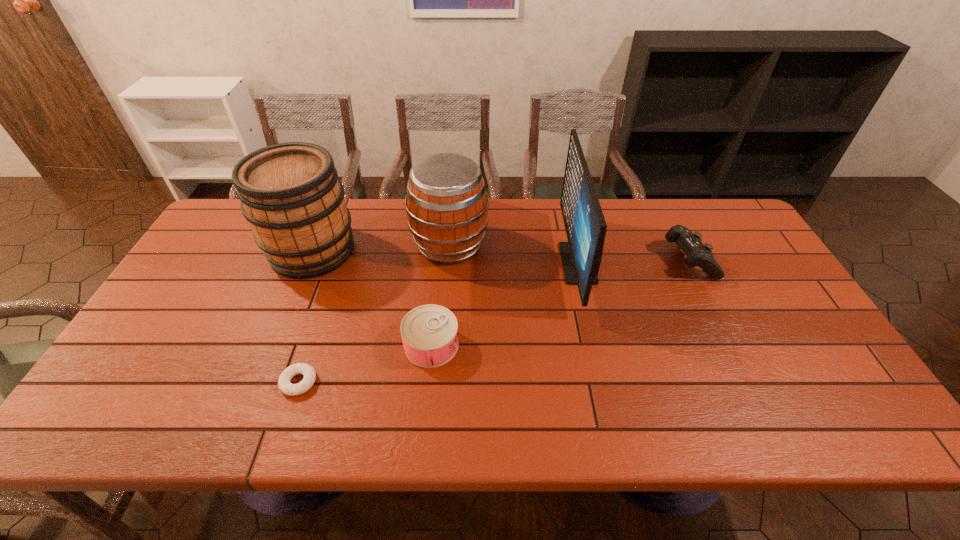
This screenshot has height=540, width=960. In order to click on vacant area that lies between the fifth object from left to right and the right cider in this screenshot , I will do `click(514, 254)`.

Identify the location of the fifth closest object relative to the left cider. (698, 254).

Where is `the fourth closest object relative to the doughnut`? The width and height of the screenshot is (960, 540). the fourth closest object relative to the doughnut is located at coordinates (585, 225).

Locate an element on the screen. This screenshot has width=960, height=540. free space that satisfies the following two spatial constraints: 1. on the back side of the fifth tallest object; 2. on the right side of the doughnut is located at coordinates (311, 345).